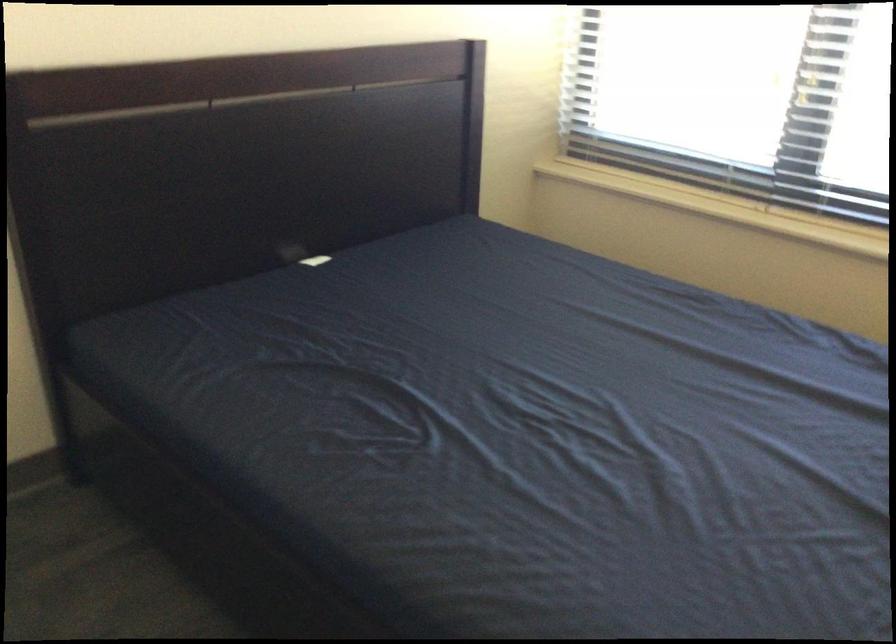
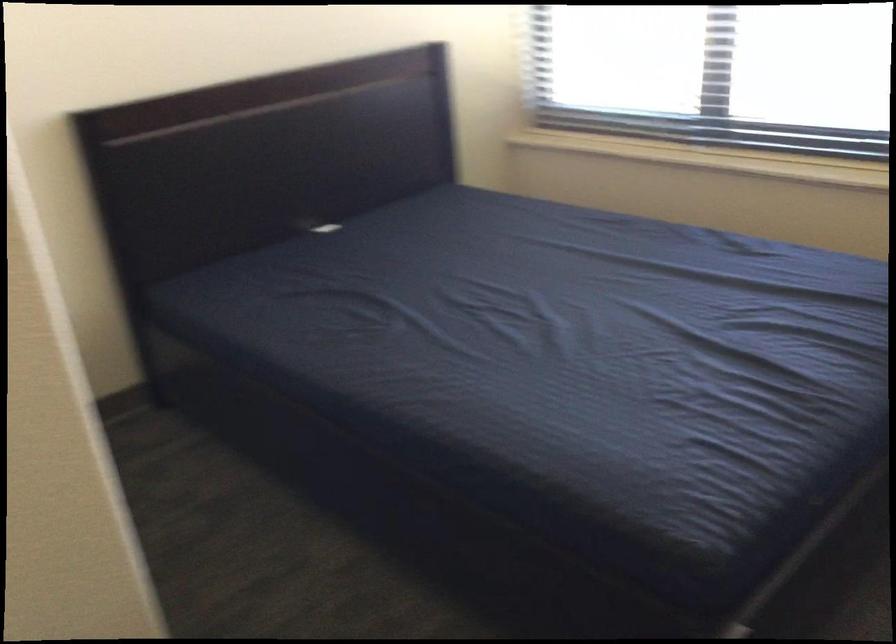
Question: Based on the continuous images, in which direction is the camera rotating? Reply with the corresponding letter.

Choices:
 (A) Left
 (B) Right
 (C) Up
 (D) Down

Answer: (A)